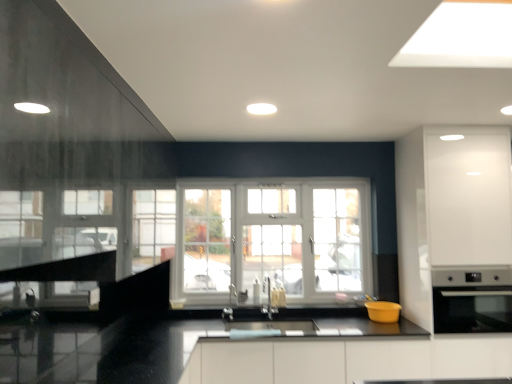
Question: Does yellow matte bowl at lower center, the first appliance when ordered from left to right, have a greater height compared to satin nickel faucet at center, which is the second faucet from left to right?

Choices:
 (A) no
 (B) yes

Answer: (A)

Question: Is yellow matte bowl at lower center, the first appliance when ordered from left to right, not within satin nickel faucet at center, which is the first faucet in right-to-left order?

Choices:
 (A) yes
 (B) no

Answer: (A)

Question: From a real-world perspective, is yellow matte bowl at lower center, which ranks as the 2th appliance in right-to-left order, on satin nickel faucet at center, which is the second faucet from left to right?

Choices:
 (A) yes
 (B) no

Answer: (B)

Question: Can you confirm if yellow matte bowl at lower center, the first appliance when ordered from left to right, is bigger than satin nickel faucet at center, which is the first faucet in right-to-left order?

Choices:
 (A) yes
 (B) no

Answer: (A)

Question: Is yellow matte bowl at lower center, which ranks as the 2th appliance in right-to-left order, further to camera compared to satin nickel faucet at center, which is the first faucet in right-to-left order?

Choices:
 (A) yes
 (B) no

Answer: (B)

Question: Is satin nickel faucet at center, which is the second faucet from left to right, wider or thinner than satin silver oven at right, positioned as the 1th appliance in right-to-left order?

Choices:
 (A) wide
 (B) thin

Answer: (B)

Question: Is point (271, 317) positioned closer to the camera than point (465, 283)?

Choices:
 (A) closer
 (B) farther

Answer: (B)

Question: Which is correct: satin nickel faucet at center, which is the second faucet from left to right, is inside satin silver oven at right, the second appliance viewed from the left, or outside of it?

Choices:
 (A) outside
 (B) inside

Answer: (A)

Question: From the image's perspective, is satin nickel faucet at center, which is the second faucet from left to right, located above or below satin silver oven at right, the second appliance viewed from the left?

Choices:
 (A) above
 (B) below

Answer: (B)

Question: Considering the positions of white plastic window at center and black glossy countertop at center in the image, is white plastic window at center bigger or smaller than black glossy countertop at center?

Choices:
 (A) big
 (B) small

Answer: (B)

Question: From the image's perspective, relative to black glossy countertop at center, is white plastic window at center above or below?

Choices:
 (A) below
 (B) above

Answer: (B)

Question: Does point (165, 206) appear closer or farther from the camera than point (237, 342)?

Choices:
 (A) farther
 (B) closer

Answer: (A)

Question: Considering the positions of white plastic window at center and black glossy countertop at center in the image, is white plastic window at center wider or thinner than black glossy countertop at center?

Choices:
 (A) wide
 (B) thin

Answer: (B)

Question: From the image's perspective, is white plastic window at center above or below satin nickel faucet at center, which appears as the second faucet when viewed from the right?

Choices:
 (A) below
 (B) above

Answer: (B)

Question: Would you say white plastic window at center is to the left or to the right of satin nickel faucet at center, which appears as the second faucet when viewed from the right, in the picture?

Choices:
 (A) right
 (B) left

Answer: (A)